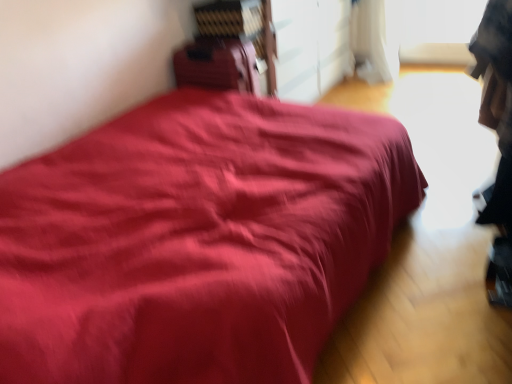
Question: Is matte red bed at center closer to camera compared to matte red suitcase at center?

Choices:
 (A) yes
 (B) no

Answer: (A)

Question: Are matte red bed at center and matte red suitcase at center located far from each other?

Choices:
 (A) yes
 (B) no

Answer: (B)

Question: From a real-world perspective, is matte red bed at center on top of matte red suitcase at center?

Choices:
 (A) no
 (B) yes

Answer: (A)

Question: Considering the relative sizes of matte red bed at center and matte red suitcase at center in the image provided, is matte red bed at center thinner than matte red suitcase at center?

Choices:
 (A) yes
 (B) no

Answer: (B)

Question: Does matte red bed at center turn towards matte red suitcase at center?

Choices:
 (A) no
 (B) yes

Answer: (A)

Question: From the image's perspective, is matte red bed at center located above matte red suitcase at center?

Choices:
 (A) no
 (B) yes

Answer: (A)

Question: Considering the relative sizes of matte red suitcase at center and matte red bed at center in the image provided, is matte red suitcase at center wider than matte red bed at center?

Choices:
 (A) yes
 (B) no

Answer: (B)

Question: Considering the relative sizes of matte red suitcase at center and matte red bed at center in the image provided, is matte red suitcase at center smaller than matte red bed at center?

Choices:
 (A) yes
 (B) no

Answer: (A)

Question: Would you say matte red bed at center is part of matte red suitcase at center's contents?

Choices:
 (A) yes
 (B) no

Answer: (B)

Question: Does matte red suitcase at center have a lesser height compared to matte red bed at center?

Choices:
 (A) no
 (B) yes

Answer: (A)

Question: Considering the relative positions of matte red suitcase at center and matte red bed at center in the image provided, is matte red suitcase at center behind matte red bed at center?

Choices:
 (A) no
 (B) yes

Answer: (B)

Question: From the image's perspective, is matte red suitcase at center above matte red bed at center?

Choices:
 (A) yes
 (B) no

Answer: (A)

Question: Does point (373, 114) appear closer or farther from the camera than point (204, 66)?

Choices:
 (A) farther
 (B) closer

Answer: (B)